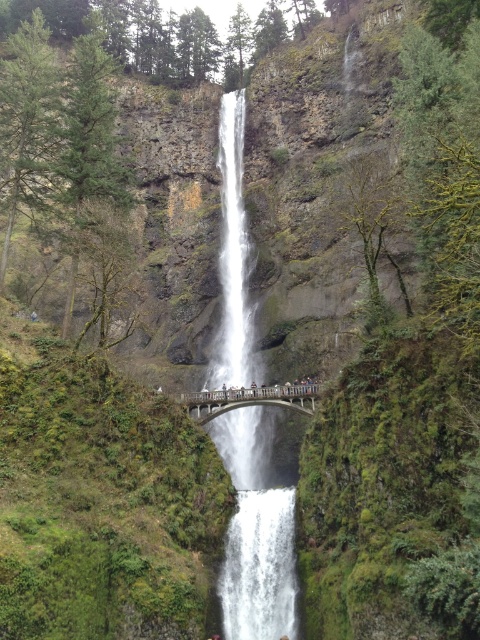
Question: Which is nearer to the green mossy rock at center?

Choices:
 (A) smooth skin person at center
 (B) smooth concrete bridge at center
 (C) smooth gray bridge at center
 (D) wooden bridge at center

Answer: (A)

Question: Which point is closer to the camera taking this photo?

Choices:
 (A) (279, 637)
 (B) (288, 570)
 (C) (300, 410)
 (D) (224, 397)

Answer: (A)

Question: Is smooth gray bridge at center below light brown wooden bridge at center?

Choices:
 (A) yes
 (B) no

Answer: (A)

Question: Which point is closer to the camera?

Choices:
 (A) (257, 401)
 (B) (36, 317)
 (C) (226, 388)

Answer: (A)

Question: Does smooth concrete bridge at center appear on the left side of green mossy rock at center?

Choices:
 (A) no
 (B) yes

Answer: (A)

Question: Does smooth concrete bridge at center have a lesser width compared to light brown wooden bridge at center?

Choices:
 (A) no
 (B) yes

Answer: (B)